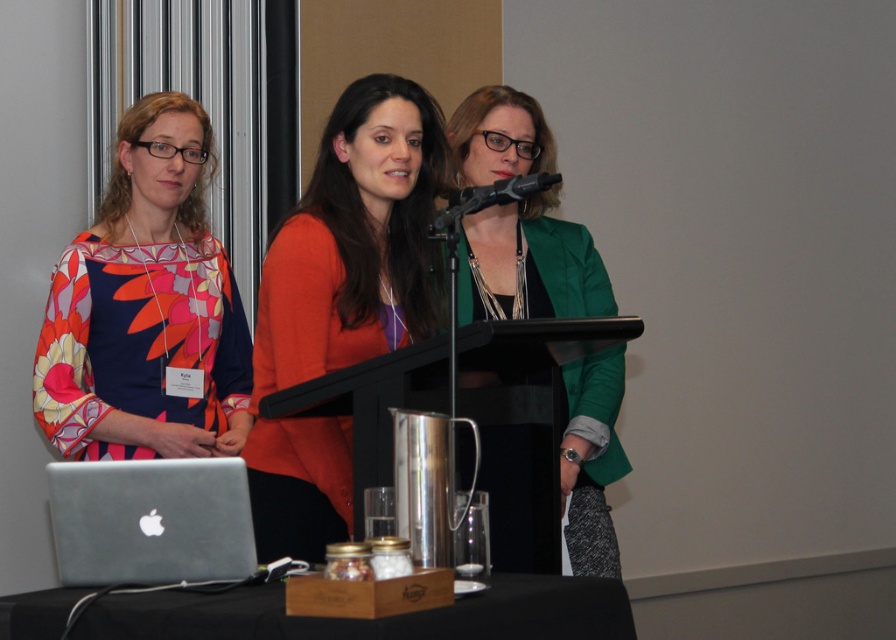
Question: Which point is closer to the camera?

Choices:
 (A) (524, 195)
 (B) (54, 371)
 (C) (604, 579)
 (D) (440, 173)

Answer: (C)

Question: Is orange fabric sweater at center closer to camera compared to black matte podium at center?

Choices:
 (A) no
 (B) yes

Answer: (A)

Question: Which of the following is the closest to the observer?

Choices:
 (A) (82, 524)
 (B) (485, 419)
 (C) (101, 323)
 (D) (580, 269)

Answer: (A)

Question: Is green matte blazer at center to the right of black matte podium at center from the viewer's perspective?

Choices:
 (A) yes
 (B) no

Answer: (A)

Question: Which point is closer to the camera?

Choices:
 (A) (616, 340)
 (B) (532, 621)
 (C) (100, 547)
 (D) (78, 444)

Answer: (B)

Question: Is green matte blazer at center wider than sleek silver laptop at lower left?

Choices:
 (A) no
 (B) yes

Answer: (B)